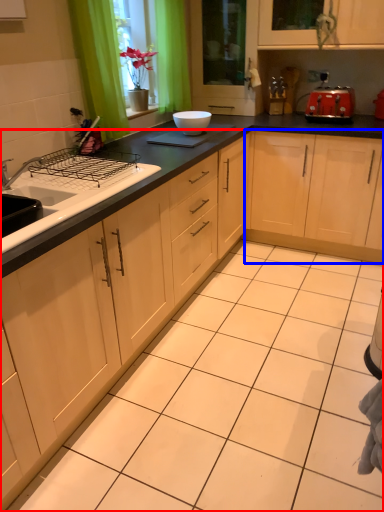
Question: Which object appears closest to the camera in this image, cabinetry (highlighted by a red box) or cabinetry (highlighted by a blue box)?

Choices:
 (A) cabinetry
 (B) cabinetry

Answer: (A)